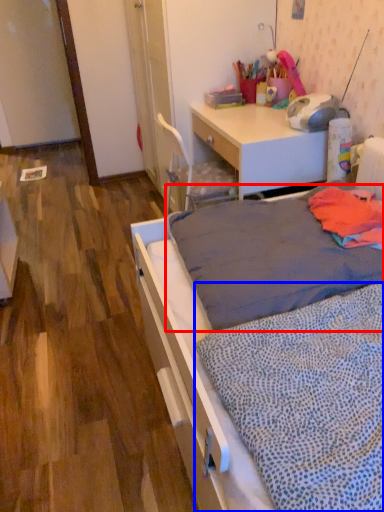
Question: Which of the following is the farthest to the observer, mattress (highlighted by a red box) or blanket (highlighted by a blue box)?

Choices:
 (A) mattress
 (B) blanket

Answer: (A)